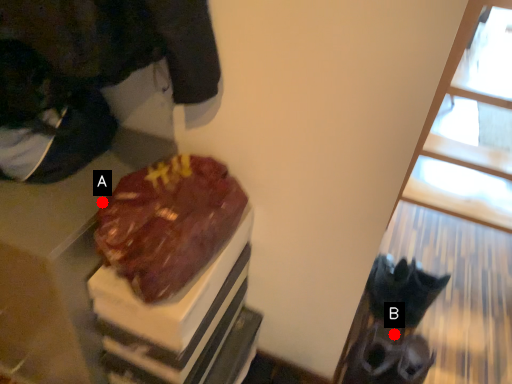
Question: Two points are circled on the image, labeled by A and B beside each circle. Which point is farther from the camera taking this photo?

Choices:
 (A) A is further
 (B) B is further

Answer: (B)